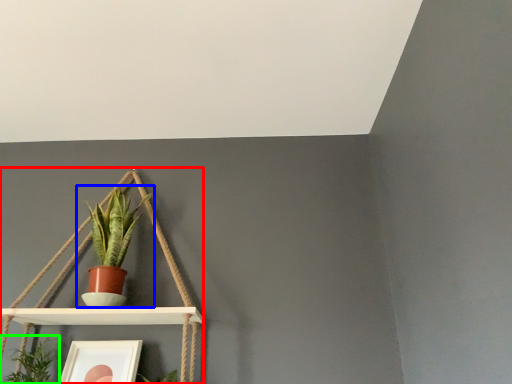
Question: Which object is the farthest from shelf (highlighted by a red box)? Choose among these: houseplant (highlighted by a blue box) or houseplant (highlighted by a green box).

Choices:
 (A) houseplant
 (B) houseplant

Answer: (B)